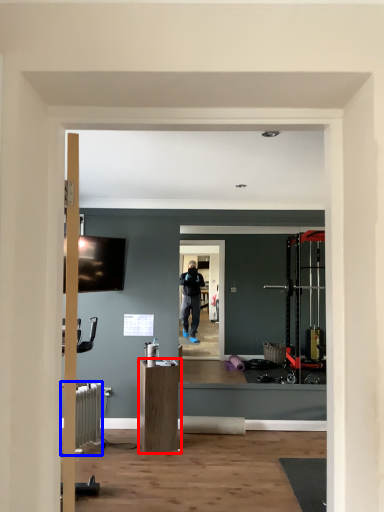
Question: Which point is further to the camera, furniture (highlighted by a red box) or radiator (highlighted by a blue box)?

Choices:
 (A) furniture
 (B) radiator

Answer: (A)